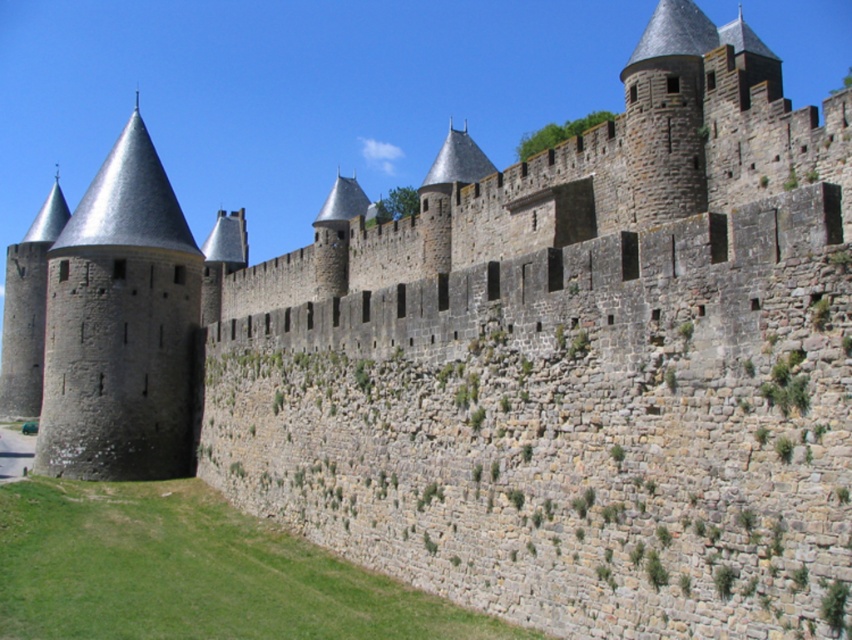
Looking at this image, you are a gardener tasked with maintaining the castle grounds. You notice the green grass at lower left and the dark gray stone tower at left. Which area requires more space for your lawnmower to maneuver around?

The dark gray stone tower at left requires more space for maneuvering because it is wider than the green grass at lower left.

You are a medieval architect examining the castle wall. You notice the green grass at lower left and the dark gray stone tower at left. Which object occupies a larger area in the scene?

The dark gray stone tower at left occupies a larger area in the scene than the green grass at lower left.

You are a medieval knight standing at the base of the castle wall. You notice green grass at lower left and a dark gray stone tower at left. Which object is closer to you as you face the wall?

The green grass at lower left is closer to you because it is in front of the dark gray stone tower at left, meaning it is positioned nearer to your viewpoint.